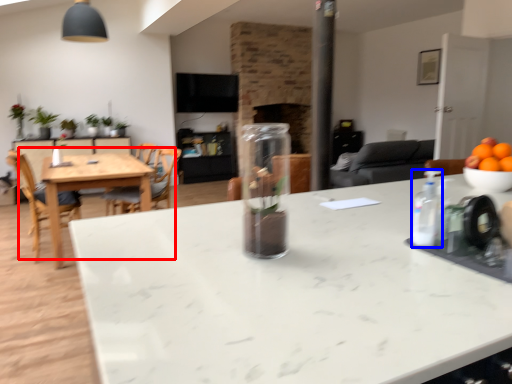
Question: Which point is further to the camera, kitchen & dining room table (highlighted by a red box) or bottle (highlighted by a blue box)?

Choices:
 (A) kitchen & dining room table
 (B) bottle

Answer: (A)